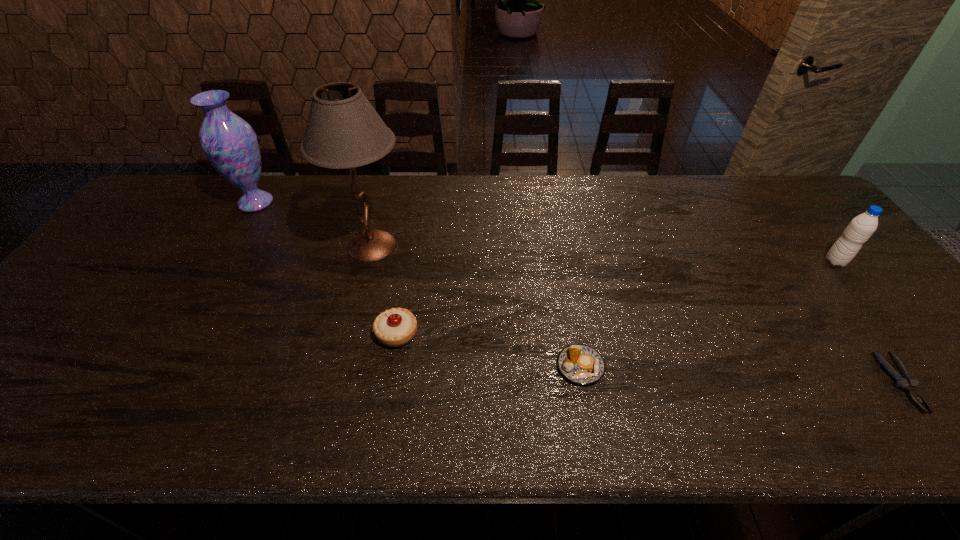
Find the location of `table lamp`. table lamp is located at coordinates (343, 130).

Locate an element on the screen. The width and height of the screenshot is (960, 540). vase is located at coordinates (230, 144).

Find the location of a particular element. the second tallest object is located at coordinates (230, 144).

The width and height of the screenshot is (960, 540). Identify the location of water bottle. (860, 229).

This screenshot has width=960, height=540. What are the coordinates of `the third tallest object` in the screenshot? It's located at 860,229.

Image resolution: width=960 pixels, height=540 pixels. Find the location of `the fourth tallest object`. the fourth tallest object is located at coordinates (395, 327).

Locate an element on the screen. The height and width of the screenshot is (540, 960). the left pastry is located at coordinates (395, 327).

Find the location of a particular element. the right pastry is located at coordinates (581, 364).

In order to click on the third object from right to left in this screenshot , I will do `click(581, 364)`.

Where is `the fifth object from left to right`? the fifth object from left to right is located at coordinates (907, 382).